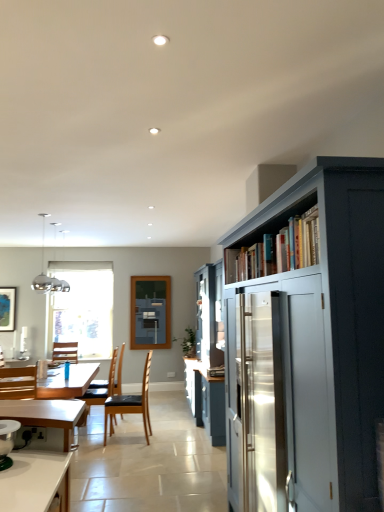
Question: Is black leather chair at center, the fourth chair when ordered from left to right, taller or shorter than matte gray cupboard at right?

Choices:
 (A) tall
 (B) short

Answer: (B)

Question: Which is correct: black leather chair at center, positioned as the 1th chair in right-to-left order, is inside matte gray cupboard at right, or outside of it?

Choices:
 (A) outside
 (B) inside

Answer: (A)

Question: Based on their relative distances, which object is farther from the blue fabric at center?

Choices:
 (A) matte black picture frame at left
 (B) wooden chair at lower left, which is the third chair from right to left
 (C) brown leather chair at lower left, which is the 2th chair from right to left
 (D) wooden chair at left, the first chair when ordered from left to right
 (E) white painted wood bookshelf at upper right

Answer: (E)

Question: Which object is the closest to the brown leather chair at lower left, which is counted as the 3th chair, starting from the front?

Choices:
 (A) white painted wood bookshelf at upper right
 (B) matte black picture frame at left
 (C) metallic glass pendant lights at upper left
 (D) black leather chair at center, arranged as the 3th chair when viewed from the back
 (E) blue fabric at center

Answer: (D)